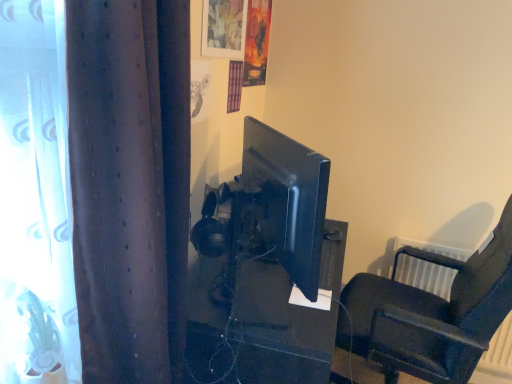
Question: Based on their sizes in the image, would you say brown textured curtain at left is bigger or smaller than matte plastic picture frame at upper center?

Choices:
 (A) small
 (B) big

Answer: (B)

Question: Looking at their shapes, would you say brown textured curtain at left is wider or thinner than matte plastic picture frame at upper center?

Choices:
 (A) wide
 (B) thin

Answer: (A)

Question: Which is nearer to the satin black monitor at center?

Choices:
 (A) matte plastic picture frame at upper center
 (B) brown textured curtain at left
 (C) black leather chair at right

Answer: (B)

Question: Which object is the closest to the matte plastic picture frame at upper center?

Choices:
 (A) black leather chair at right
 (B) satin black monitor at center
 (C) brown textured curtain at left

Answer: (C)